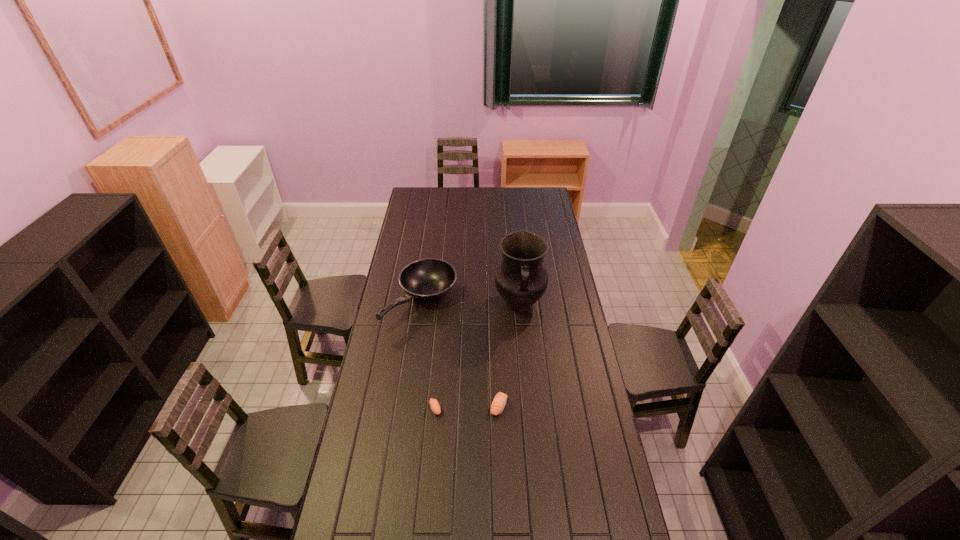
Locate an element on the screen. The height and width of the screenshot is (540, 960). free spot at the far edge of the desktop is located at coordinates (519, 201).

You are a GUI agent. You are given a task and a screenshot of the screen. Output one action in this format:
    pyautogui.click(x=<x>, y=<y>)
    Task: Click on the free space at the left edge of the desktop
    
    Given the screenshot: What is the action you would take?
    pyautogui.click(x=375, y=438)

The height and width of the screenshot is (540, 960). I want to click on vacant region at the right edge of the desktop, so click(562, 255).

Where is `free spot between the frying pan and the tallest object`? Image resolution: width=960 pixels, height=540 pixels. free spot between the frying pan and the tallest object is located at coordinates (470, 302).

Where is `vacant area between the tallest object and the frying pan`? vacant area between the tallest object and the frying pan is located at coordinates (470, 302).

This screenshot has height=540, width=960. In order to click on empty space between the right sushi and the tallest object in this screenshot , I will do 509,355.

Locate an element on the screen. The height and width of the screenshot is (540, 960). free spot between the frying pan and the left sushi is located at coordinates (428, 355).

Where is `vacant region between the second tallest object and the pitcher`? vacant region between the second tallest object and the pitcher is located at coordinates (470, 302).

This screenshot has height=540, width=960. What are the coordinates of `vacant region between the tallest object and the third shortest object` in the screenshot? It's located at (470, 302).

Identify the location of vacant area between the third shortest object and the right sushi. This screenshot has width=960, height=540. (460, 354).